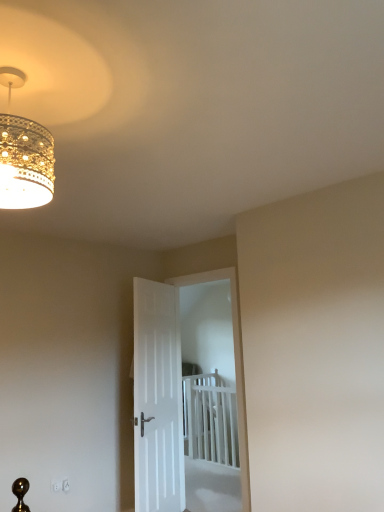
Question: Does gold textured chandelier at upper left appear on the left side of white smooth door at center, marked as the second door in a right-to-left arrangement?

Choices:
 (A) no
 (B) yes

Answer: (B)

Question: Is gold textured chandelier at upper left far away from white smooth door at center, marked as the 1th door in a left-to-right arrangement?

Choices:
 (A) no
 (B) yes

Answer: (B)

Question: Is gold textured chandelier at upper left shorter than white smooth door at center, marked as the 1th door in a left-to-right arrangement?

Choices:
 (A) yes
 (B) no

Answer: (A)

Question: Are gold textured chandelier at upper left and white smooth door at center, marked as the 1th door in a left-to-right arrangement, making contact?

Choices:
 (A) yes
 (B) no

Answer: (B)

Question: Does gold textured chandelier at upper left have a lesser width compared to white smooth door at center, marked as the 1th door in a left-to-right arrangement?

Choices:
 (A) no
 (B) yes

Answer: (A)

Question: Based on their positions, is gold textured chandelier at upper left located to the left or right of white smooth door at center, marked as the second door in a right-to-left arrangement?

Choices:
 (A) right
 (B) left

Answer: (B)

Question: Is gold textured chandelier at upper left in front of or behind white smooth door at center, marked as the second door in a right-to-left arrangement, in the image?

Choices:
 (A) behind
 (B) front

Answer: (B)

Question: From a real-world perspective, relative to white smooth door at center, marked as the 1th door in a left-to-right arrangement, is gold textured chandelier at upper left vertically above or below?

Choices:
 (A) above
 (B) below

Answer: (A)

Question: Is gold textured chandelier at upper left bigger or smaller than white smooth door at center, marked as the second door in a right-to-left arrangement?

Choices:
 (A) big
 (B) small

Answer: (B)

Question: In terms of width, does white plastic bed at center look wider or thinner when compared to gold textured chandelier at upper left?

Choices:
 (A) wide
 (B) thin

Answer: (B)

Question: Considering their positions, is white plastic bed at center located in front of or behind gold textured chandelier at upper left?

Choices:
 (A) behind
 (B) front

Answer: (A)

Question: From the image's perspective, is white plastic bed at center above or below gold textured chandelier at upper left?

Choices:
 (A) below
 (B) above

Answer: (A)

Question: Which is correct: white plastic bed at center is inside gold textured chandelier at upper left, or outside of it?

Choices:
 (A) outside
 (B) inside

Answer: (A)

Question: From the image's perspective, is white matte door at center, which appears as the 2th door when viewed from the left, located above or below white smooth door at center, marked as the 1th door in a left-to-right arrangement?

Choices:
 (A) above
 (B) below

Answer: (A)

Question: From their relative heights in the image, would you say white matte door at center, which appears as the 2th door when viewed from the left, is taller or shorter than white smooth door at center, marked as the second door in a right-to-left arrangement?

Choices:
 (A) tall
 (B) short

Answer: (A)